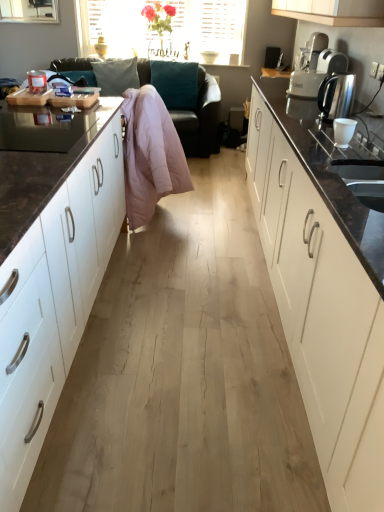
Question: Does white matte cabinet at left, which ranks as the 2th cabinetry in right-to-left order, appear on the right side of white glossy cabinet at right, the 2th cabinetry in the left-to-right sequence?

Choices:
 (A) yes
 (B) no

Answer: (B)

Question: Is white matte cabinet at left, placed as the 1th cabinetry when sorted from left to right, behind white glossy cabinet at right, marked as the first cabinetry in a right-to-left arrangement?

Choices:
 (A) no
 (B) yes

Answer: (B)

Question: Is white matte cabinet at left, placed as the 1th cabinetry when sorted from left to right, closer to the viewer compared to white glossy cabinet at right, marked as the first cabinetry in a right-to-left arrangement?

Choices:
 (A) no
 (B) yes

Answer: (A)

Question: Is white matte cabinet at left, which ranks as the 2th cabinetry in right-to-left order, looking in the opposite direction of white glossy cabinet at right, marked as the first cabinetry in a right-to-left arrangement?

Choices:
 (A) yes
 (B) no

Answer: (B)

Question: From a real-world perspective, is white matte cabinet at left, which ranks as the 2th cabinetry in right-to-left order, physically below white glossy cabinet at right, marked as the first cabinetry in a right-to-left arrangement?

Choices:
 (A) yes
 (B) no

Answer: (B)

Question: Can you confirm if white matte cabinet at left, which ranks as the 2th cabinetry in right-to-left order, is wider than white glossy cabinet at right, marked as the first cabinetry in a right-to-left arrangement?

Choices:
 (A) yes
 (B) no

Answer: (A)

Question: Would you consider white matte cabinet at left, placed as the 1th cabinetry when sorted from left to right, to be distant from pink down jacket at center?

Choices:
 (A) no
 (B) yes

Answer: (A)

Question: Is white matte cabinet at left, which ranks as the 2th cabinetry in right-to-left order, to the left of pink down jacket at center from the viewer's perspective?

Choices:
 (A) no
 (B) yes

Answer: (B)

Question: Is white matte cabinet at left, which ranks as the 2th cabinetry in right-to-left order, wider than pink down jacket at center?

Choices:
 (A) no
 (B) yes

Answer: (B)

Question: Is white matte cabinet at left, which ranks as the 2th cabinetry in right-to-left order, not inside pink down jacket at center?

Choices:
 (A) no
 (B) yes

Answer: (B)

Question: Can you confirm if white matte cabinet at left, which ranks as the 2th cabinetry in right-to-left order, is positioned to the right of pink down jacket at center?

Choices:
 (A) yes
 (B) no

Answer: (B)

Question: Is white matte cabinet at left, which ranks as the 2th cabinetry in right-to-left order, thinner than pink down jacket at center?

Choices:
 (A) no
 (B) yes

Answer: (A)

Question: Is white plastic toaster at upper right behind white matte cabinet at left, which ranks as the 2th cabinetry in right-to-left order?

Choices:
 (A) no
 (B) yes

Answer: (B)